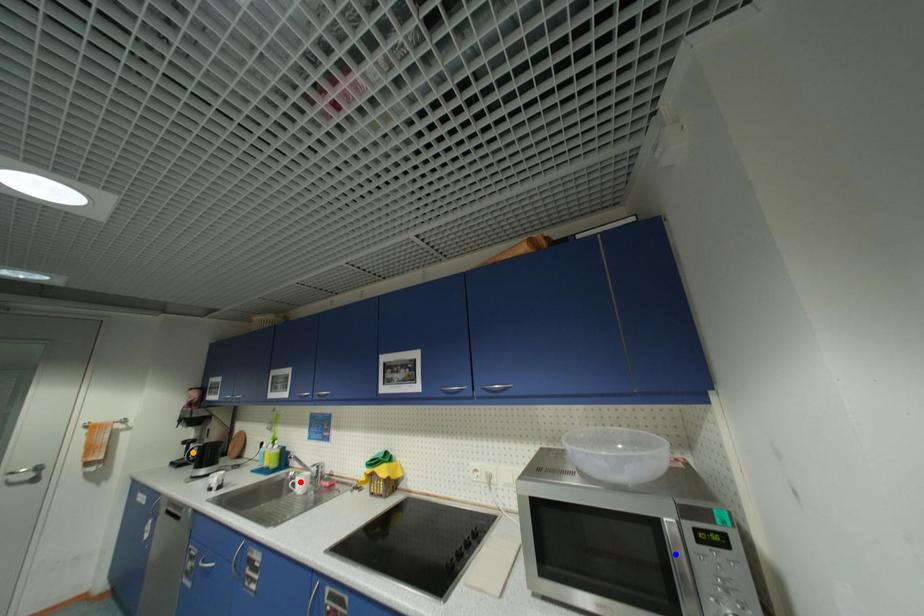
Consider the image. Order these from nearest to farthest:
red point, blue point, orange point

blue point < red point < orange point